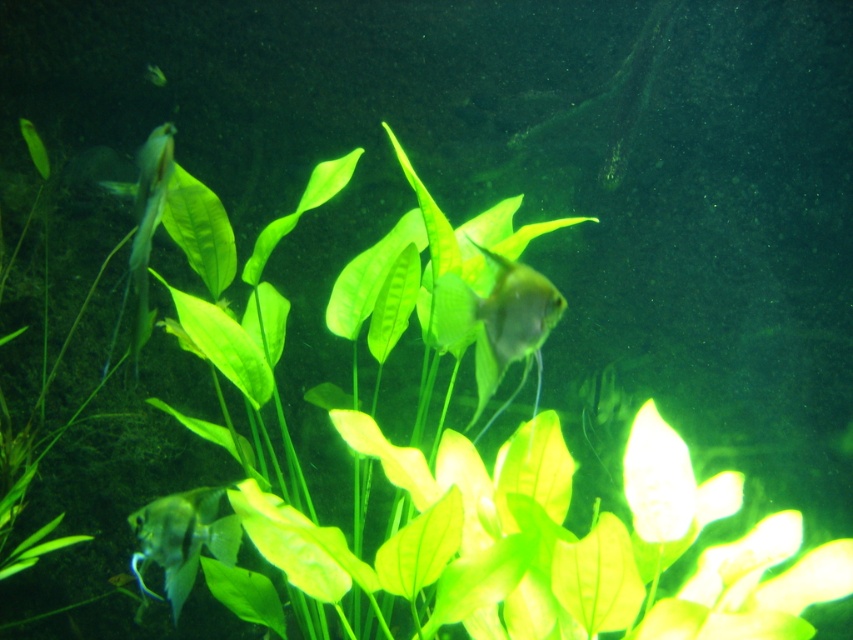
Question: Among these objects, which one is nearest to the camera?

Choices:
 (A) translucent silver fish at lower left
 (B) translucent white fish at left

Answer: (B)

Question: Does transparent glass fish at center have a smaller size compared to translucent white fish at left?

Choices:
 (A) no
 (B) yes

Answer: (B)

Question: Is transparent glass fish at center wider than translucent silver fish at lower left?

Choices:
 (A) no
 (B) yes

Answer: (A)

Question: Based on their relative distances, which object is farther from the translucent silver fish at lower left?

Choices:
 (A) translucent white fish at left
 (B) transparent glass fish at center

Answer: (B)

Question: Which of these objects is positioned closest to the translucent silver fish at lower left?

Choices:
 (A) transparent glass fish at center
 (B) translucent white fish at left

Answer: (B)

Question: Does transparent glass fish at center have a greater width compared to translucent silver fish at lower left?

Choices:
 (A) no
 (B) yes

Answer: (A)